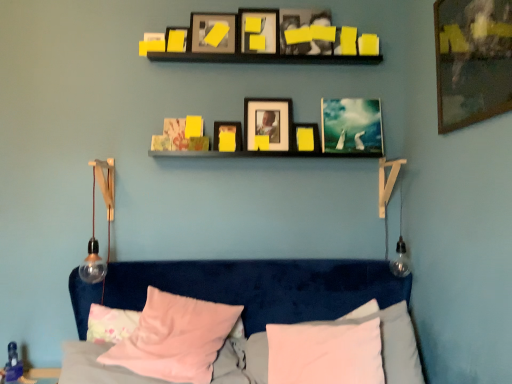
Question: In terms of width, does matte black picture frame at center, positioned as the third picture frame in back-to-front order, look wider or thinner when compared to pink fabric pillow at lower center, placed as the second pillow when sorted from right to left?

Choices:
 (A) wide
 (B) thin

Answer: (B)

Question: From their relative heights in the image, would you say matte black picture frame at center, positioned as the third picture frame in back-to-front order, is taller or shorter than pink fabric pillow at lower center, placed as the second pillow when sorted from right to left?

Choices:
 (A) short
 (B) tall

Answer: (B)

Question: Which object is the closest to the matte black picture frame at upper center, the fourth picture frame in the front-to-back sequence?

Choices:
 (A) wooden framed artwork at upper right, acting as the 1th picture frame starting from the front
 (B) metallic silver picture frame at center, the 1th picture frame in the back-to-front sequence
 (C) matte yellow picture frame at center, the fourth picture frame from the back
 (D) pink fabric pillow at lower center, which appears as the second pillow when viewed from the left
 (E) matte black picture frame at upper left, the second picture frame positioned from the front

Answer: (E)

Question: Estimate the real-world distances between objects in this image. Which object is farther from the matte black picture frame at upper center, the fifth picture frame when ordered from back to front?

Choices:
 (A) matte yellow picture frame at center, which is counted as the 6th picture frame, starting from the front
 (B) matte black picture frame at upper center, which is the sixth picture frame from back to front
 (C) pink fabric pillow at lower left, which ranks as the 1th pillow in left-to-right order
 (D) clear glass bulb at left
 (E) matte black picture frame at upper left, the 8th picture frame positioned from the back

Answer: (C)